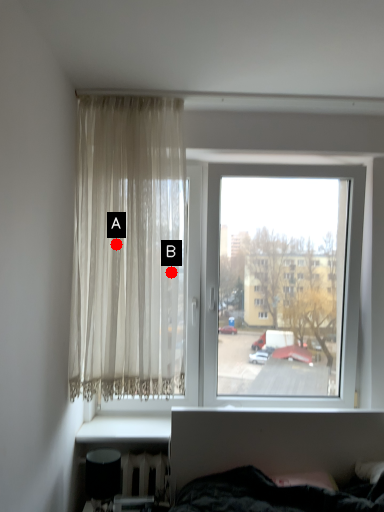
Question: Two points are circled on the image, labeled by A and B beside each circle. Which of the following is the closest to the observer?

Choices:
 (A) A is closer
 (B) B is closer

Answer: (A)